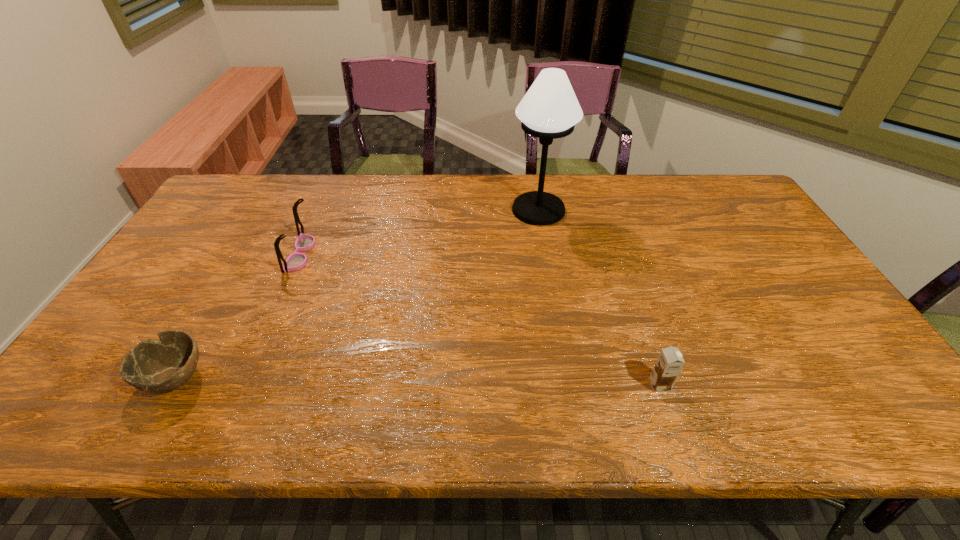
Identify which object is located as the second nearest to the second shortest object. Please provide its 2D coordinates. Your answer should be formatted as a tuple, i.e. [(x, y)], where the tuple contains the x and y coordinates of a point satisfying the conditions above.

[(295, 261)]

I want to click on object identified as the second closest to the chocolate milk, so click(295, 261).

The height and width of the screenshot is (540, 960). In order to click on free point that satisfies the following two spatial constraints: 1. on the back side of the third object from right to left; 2. on the left side of the second object from right to left in this screenshot , I will do `click(320, 210)`.

Identify the location of vacant area that satisfies the following two spatial constraints: 1. on the back side of the spectacles; 2. on the left side of the bowl. This screenshot has height=540, width=960. (247, 254).

The image size is (960, 540). I want to click on vacant region that satisfies the following two spatial constraints: 1. on the back side of the leftmost object; 2. on the left side of the farthest object, so click(272, 210).